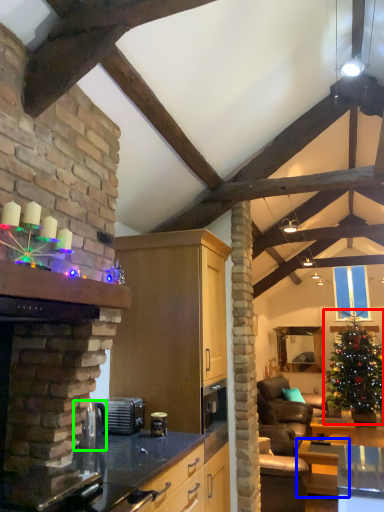
Question: Considering the real-world distances, which object is closest to christmas tree (highlighted by a red box)? table (highlighted by a blue box) or appliance (highlighted by a green box).

Choices:
 (A) table
 (B) appliance

Answer: (A)